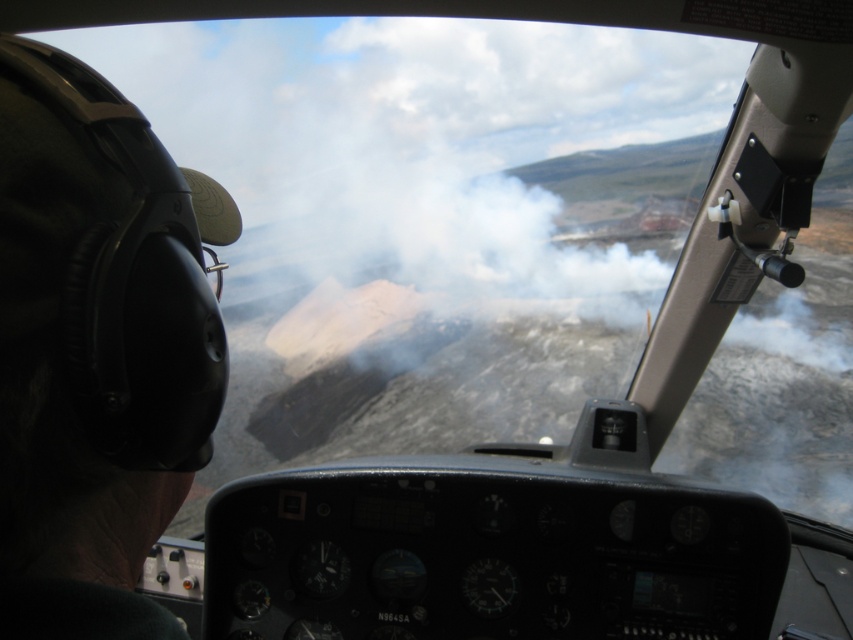
Between black matte helmet at left and white fluffy cloud at upper center, which one has less height?

With less height is black matte helmet at left.

Who is positioned more to the left, black matte helmet at left or white fluffy cloud at upper center?

black matte helmet at left is more to the left.

Identify the location of black matte helmet at left. The width and height of the screenshot is (853, 640). (96, 348).

At what (x,y) coordinates should I click in order to perform the action: click on black matte helmet at left. Please return your answer as a coordinate pair (x, y). The image size is (853, 640). Looking at the image, I should click on (96, 348).